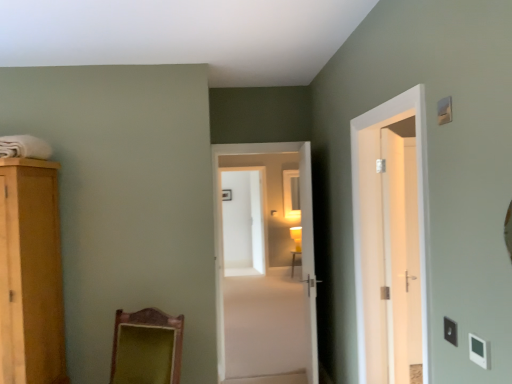
Question: Is white plastic light switch at lower right, positioned as the 1th light switch in front-to-back order, taller or shorter than white glossy screen door at center?

Choices:
 (A) tall
 (B) short

Answer: (B)

Question: Based on their positions, is white plastic light switch at lower right, arranged as the 1th light switch when ordered from the bottom, located to the left or right of white glossy screen door at center?

Choices:
 (A) right
 (B) left

Answer: (A)

Question: Considering the real-world distances, which object is farthest from the matte yellow lampshade at center?

Choices:
 (A) white glossy door at center, the third door when ordered from front to back
 (B) white glossy door at upper right, which is the second door in right-to-left order
 (C) white glossy door at right, marked as the 1th door in a right-to-left arrangement
 (D) white plastic light switch at lower right, the second light switch positioned from the top
 (E) white plastic light switch at upper right, marked as the third light switch in a bottom-to-top arrangement

Answer: (E)

Question: Considering the real-world distances, which object is farthest from the white plastic light switch at lower right, the second light switch positioned from the top?

Choices:
 (A) white glossy door at upper right, marked as the third door in a left-to-right arrangement
 (B) matte yellow lampshade at center
 (C) white plastic light switch at lower right, positioned as the 1th light switch in front-to-back order
 (D) white plastic light switch at upper right, positioned as the second light switch in back-to-front order
 (E) white glossy door at right, acting as the fourth door starting from the left

Answer: (B)